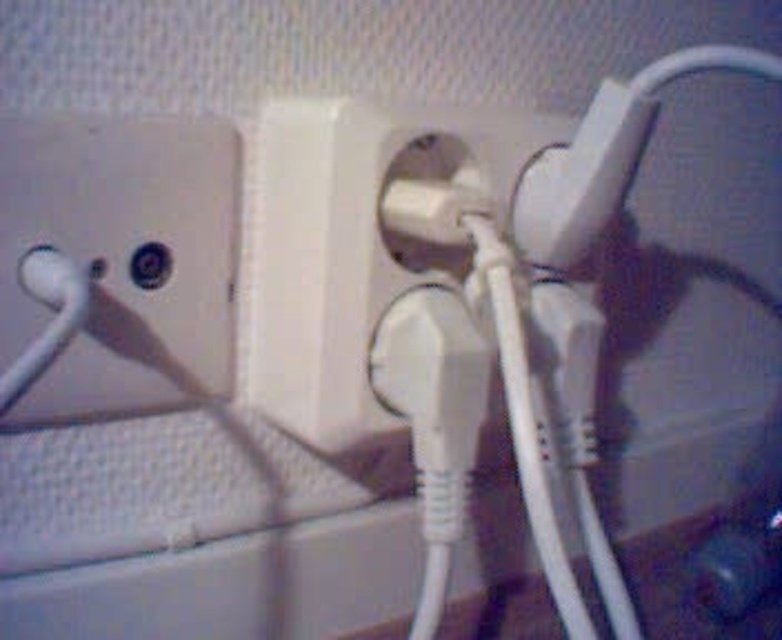
The width and height of the screenshot is (782, 640). What do you see at coordinates (119, 259) in the screenshot?
I see `white plastic outlet at upper left` at bounding box center [119, 259].

The width and height of the screenshot is (782, 640). Describe the element at coordinates (119, 259) in the screenshot. I see `white plastic outlet at upper left` at that location.

The image size is (782, 640). I want to click on white plastic outlet at upper left, so click(x=119, y=259).